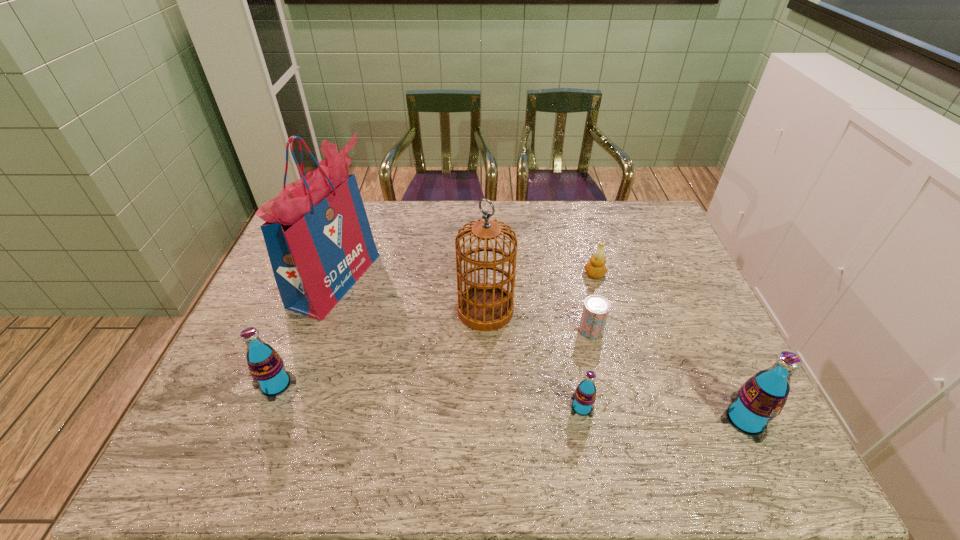
This screenshot has width=960, height=540. Find the location of `free space for an extra pop_(soda) to achieve even spacing`. free space for an extra pop_(soda) to achieve even spacing is located at coordinates (425, 396).